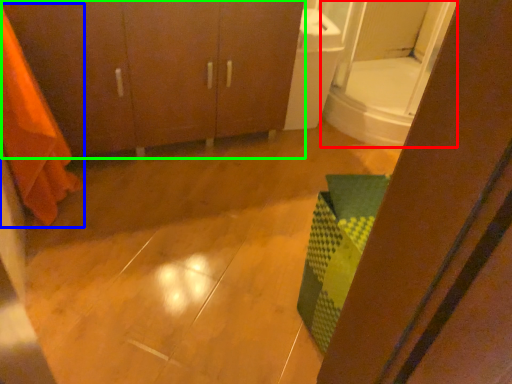
Question: Which is nearer to the mirror (highlighted by a red box)? shower curtain (highlighted by a blue box) or bathroom cabinet (highlighted by a green box).

Choices:
 (A) shower curtain
 (B) bathroom cabinet

Answer: (B)